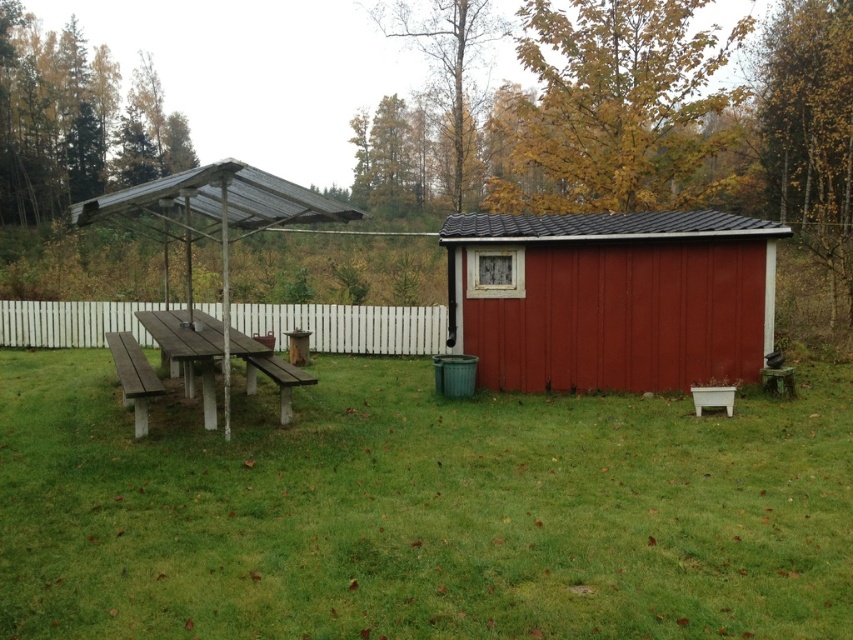
You are planning to set up a small garden in the center of the scene. You have a garden tool that requires a surface taller than the wooden bench at center. Can the white wooden fence at center provide a suitable surface for this tool?

The white wooden fence at center is shorter than the wooden bench at center, so it cannot provide a suitable surface for the garden tool that requires a taller surface than the wooden bench at center.

You are standing at point (421, 509) in the scene. What is the object under your feet?

The object under your feet at point (421, 509) is green grass at center.

You are standing at the picnic table under the canopy and want to place a new item at the point marked as point (610, 298). What object is already located there?

The matte red shed at center right is located at point (610, 298).